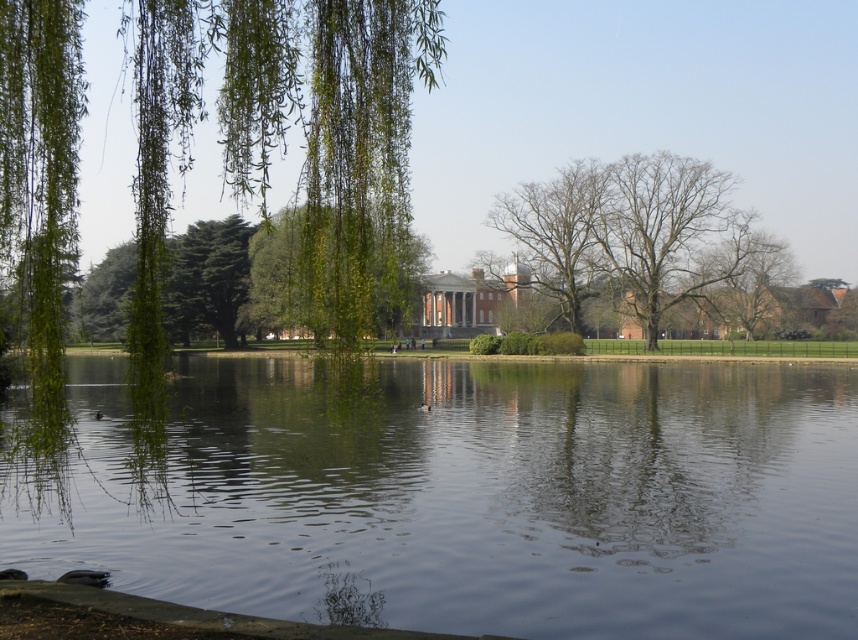
Based on the photo, is transparent water at center positioned behind green leafy willow at left?

No, it is not.

Who is lower down, transparent water at center or green leafy willow at left?

Positioned lower is transparent water at center.

Is point (705, 609) closer to camera compared to point (198, 17)?

That is True.

The height and width of the screenshot is (640, 858). Identify the location of transparent water at center. (466, 496).

Is green leafy willow at left above bare wood tree at center?

Indeed, green leafy willow at left is positioned over bare wood tree at center.

Does green leafy willow at left appear under bare wood tree at center?

No.

Where is `green leafy willow at left`? green leafy willow at left is located at coordinates (189, 145).

I want to click on green leafy willow at left, so click(x=189, y=145).

Is green leafy willow at left closer to the viewer compared to bare branches at center?

Yes, green leafy willow at left is in front of bare branches at center.

Is green leafy willow at left thinner than bare branches at center?

No, green leafy willow at left is not thinner than bare branches at center.

This screenshot has height=640, width=858. What do you see at coordinates (189, 145) in the screenshot?
I see `green leafy willow at left` at bounding box center [189, 145].

You are a GUI agent. You are given a task and a screenshot of the screen. Output one action in this format:
    pyautogui.click(x=<x>, y=<y>)
    Task: Click on the green leafy willow at left
    Image resolution: width=858 pixels, height=640 pixels.
    Given the screenshot: What is the action you would take?
    pyautogui.click(x=189, y=145)